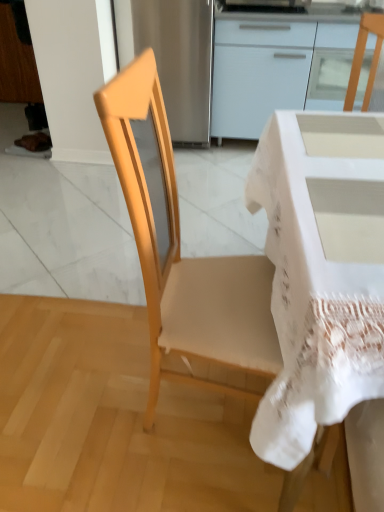
Measure the distance between white lace-covered desk at center and camera.

The depth of white lace-covered desk at center is 23.11 inches.

Where is `white glossy cabinet at upper center`? white glossy cabinet at upper center is located at coordinates (277, 66).

Find the location of a particular element. The width and height of the screenshot is (384, 512). white lace-covered desk at center is located at coordinates (320, 271).

Is white glossy cabinet at upper center aimed at white lace-covered desk at center?

Yes, white glossy cabinet at upper center is aimed at white lace-covered desk at center.

Considering the relative sizes of white glossy cabinet at upper center and white lace-covered desk at center in the image provided, is white glossy cabinet at upper center bigger than white lace-covered desk at center?

Yes.

Considering the relative sizes of white glossy cabinet at upper center and white lace-covered desk at center in the image provided, is white glossy cabinet at upper center thinner than white lace-covered desk at center?

Yes, white glossy cabinet at upper center is thinner than white lace-covered desk at center.

What's the angular difference between white glossy cabinet at upper center and white lace-covered desk at center's facing directions?

86.7 degrees.

Could you tell me if white glossy cabinet at upper center is facing light wood chair at center?

Yes, white glossy cabinet at upper center faces towards light wood chair at center.

Does white glossy cabinet at upper center lie behind light wood chair at center?

Yes, it is behind light wood chair at center.

Between white glossy cabinet at upper center and light wood chair at center, which one has smaller width?

light wood chair at center is thinner.

Which of these two, light wood chair at center or white lace-covered desk at center, is wider?

With larger width is white lace-covered desk at center.

Where is `desk below the light wood chair at center (from the image's perspective)`? Image resolution: width=384 pixels, height=512 pixels. desk below the light wood chair at center (from the image's perspective) is located at coordinates (320, 271).

Between light wood chair at center and white lace-covered desk at center, which one has more height?

Standing taller between the two is light wood chair at center.

Would you consider white lace-covered desk at center to be distant from light wood chair at center?

Actually, white lace-covered desk at center and light wood chair at center are a little close together.

Who is smaller, white lace-covered desk at center or light wood chair at center?

With smaller size is light wood chair at center.

Where is `desk that appears below the light wood chair at center (from the image's perspective)`? Image resolution: width=384 pixels, height=512 pixels. desk that appears below the light wood chair at center (from the image's perspective) is located at coordinates (320, 271).

In the scene shown: In the image, is white lace-covered desk at center on the left side or the right side of light wood chair at center?

Clearly, white lace-covered desk at center is on the right of light wood chair at center in the image.

Between light wood chair at center and white glossy cabinet at upper center, which one is positioned in front?

light wood chair at center.

Which is nearer, [236,317] or [303,104]?

The point [236,317] is in front.

Could you tell me if light wood chair at center is turned towards white glossy cabinet at upper center?

No.

Is light wood chair at center wider than white glossy cabinet at upper center?

No, light wood chair at center is not wider than white glossy cabinet at upper center.

Is white lace-covered desk at center not within white glossy cabinet at upper center?

Yes.

Which object is further away from the camera taking this photo, white lace-covered desk at center or white glossy cabinet at upper center?

white glossy cabinet at upper center is further from the camera.

Is white lace-covered desk at center aimed at white glossy cabinet at upper center?

No, white lace-covered desk at center is not facing towards white glossy cabinet at upper center.

In the image, there is a white glossy cabinet at upper center. What are the coordinates of `desk below it (from the image's perspective)` in the screenshot? It's located at (320, 271).

Locate an element on the screen. Image resolution: width=384 pixels, height=512 pixels. cabinetry lying behind the white lace-covered desk at center is located at coordinates (277, 66).

The height and width of the screenshot is (512, 384). I want to click on chair in front of the white glossy cabinet at upper center, so click(x=180, y=253).

When comparing their distances from light wood chair at center, does white glossy cabinet at upper center or white lace-covered desk at center seem closer?

Based on the image, white lace-covered desk at center appears to be nearer to light wood chair at center.

Estimate the real-world distances between objects in this image. Which object is further from white lace-covered desk at center, light wood chair at center or white glossy cabinet at upper center?

white glossy cabinet at upper center.

Looking at the image, which one is located closer to white lace-covered desk at center, white glossy cabinet at upper center or light wood chair at center?

light wood chair at center is closer to white lace-covered desk at center.

Considering their positions, is light wood chair at center positioned closer to white glossy cabinet at upper center than white lace-covered desk at center?

The object closer to white glossy cabinet at upper center is white lace-covered desk at center.

Looking at the image, which one is located closer to light wood chair at center, white lace-covered desk at center or white glossy cabinet at upper center?

Among the two, white lace-covered desk at center is located nearer to light wood chair at center.

Estimate the real-world distances between objects in this image. Which object is closer to white glossy cabinet at upper center, white lace-covered desk at center or light wood chair at center?

white lace-covered desk at center lies closer to white glossy cabinet at upper center than the other object.

Identify the location of chair positioned between white lace-covered desk at center and white glossy cabinet at upper center from near to far. This screenshot has width=384, height=512. (180, 253).